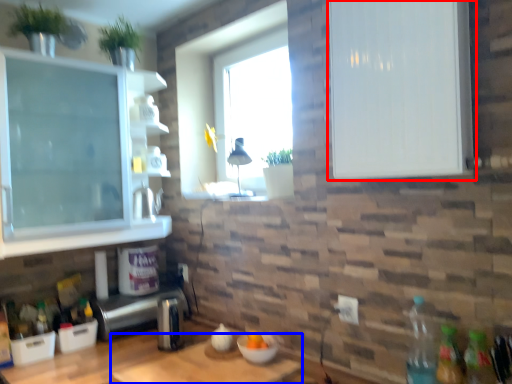
Question: Which of the following is the farthest to the observer, cabinetry (highlighted by a red box) or table (highlighted by a blue box)?

Choices:
 (A) cabinetry
 (B) table

Answer: (B)